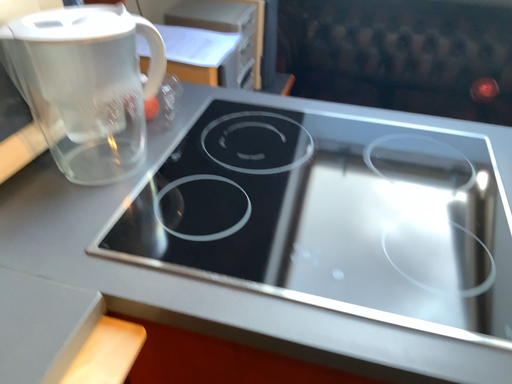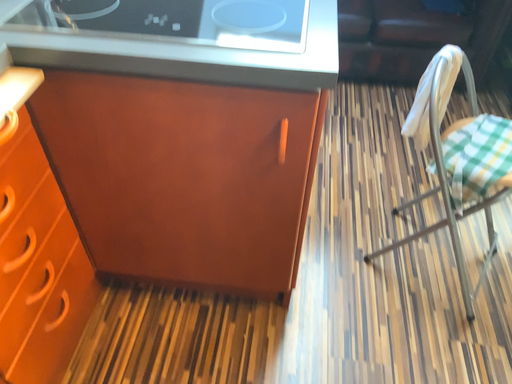
Question: Which way did the camera rotate in the video?

Choices:
 (A) rotated upward
 (B) rotated downward

Answer: (B)